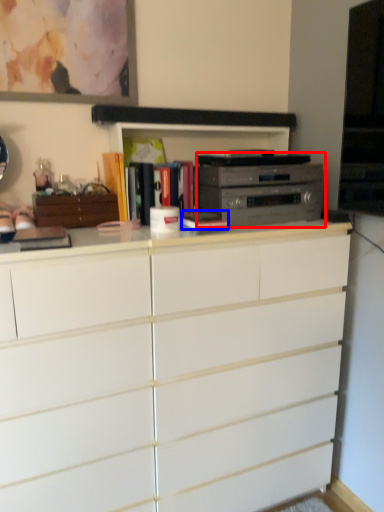
Question: Which object appears closest to the camera in this image, home appliance (highlighted by a red box) or book (highlighted by a blue box)?

Choices:
 (A) home appliance
 (B) book

Answer: (B)